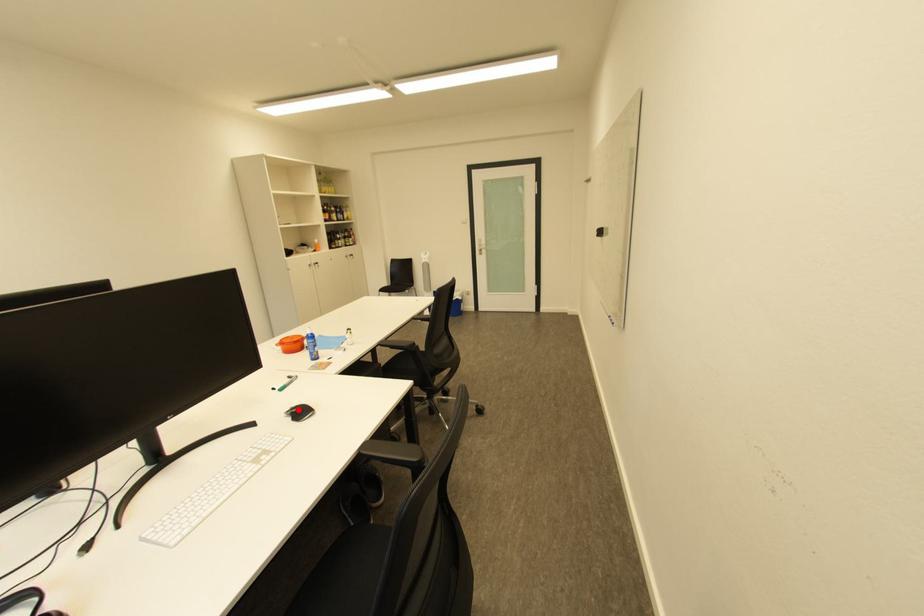
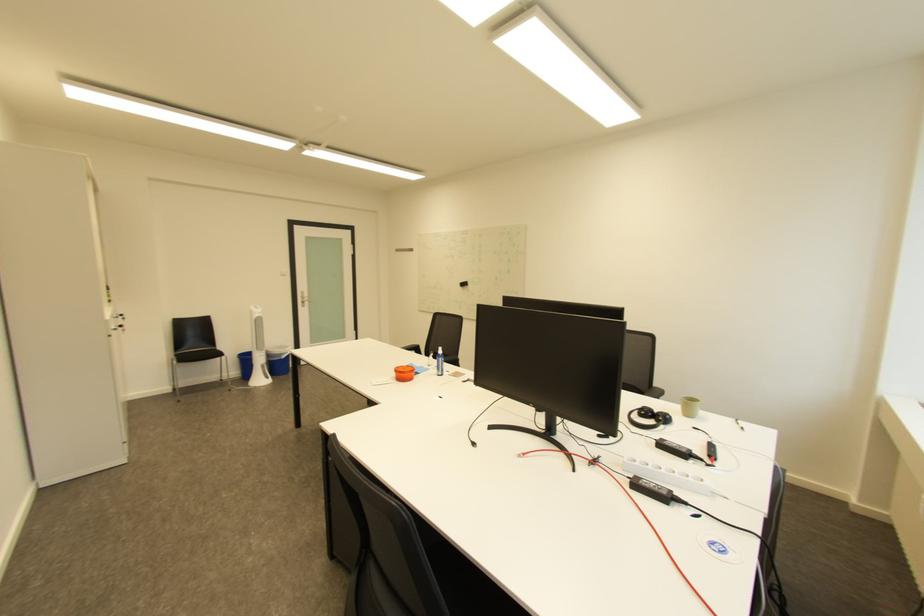
Question: I am providing you with two images of the same scene from different viewpoints. A red point is marked on the first image. Can you still see the location of the red point in image 2?

Choices:
 (A) Yes
 (B) No

Answer: (B)